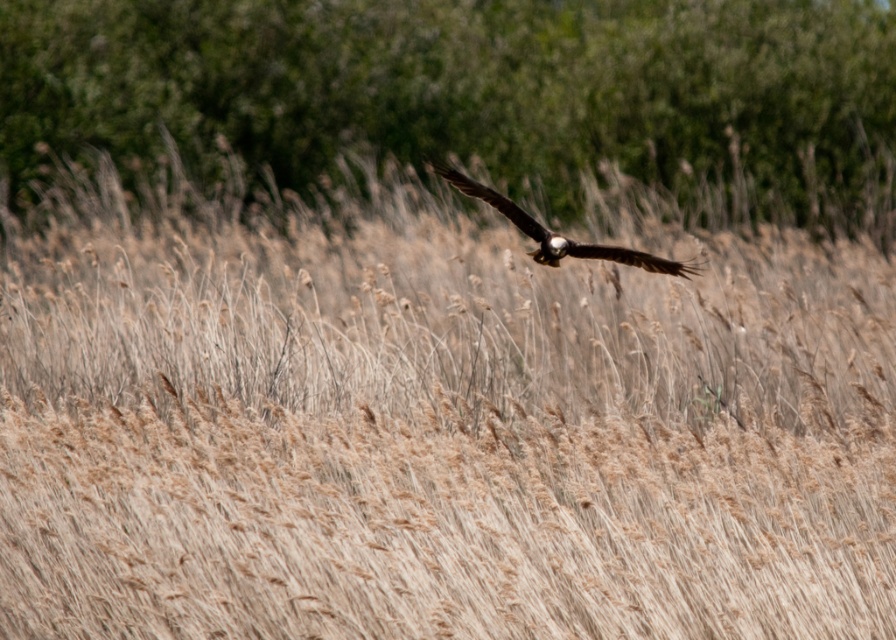
Question: Does green leafy tree at upper center have a smaller size compared to brown feathered eagle at center?

Choices:
 (A) no
 (B) yes

Answer: (A)

Question: Among these points, which one is nearest to the camera?

Choices:
 (A) (570, 198)
 (B) (562, 236)

Answer: (B)

Question: Is green leafy tree at upper center to the right of brown feathered eagle at center from the viewer's perspective?

Choices:
 (A) no
 (B) yes

Answer: (A)

Question: Can you confirm if green leafy tree at upper center is positioned below brown feathered eagle at center?

Choices:
 (A) yes
 (B) no

Answer: (B)